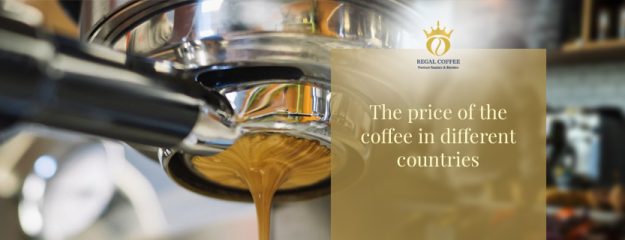
In order to click on handle of the espresso machine in this screenshot , I will do `click(114, 101)`.